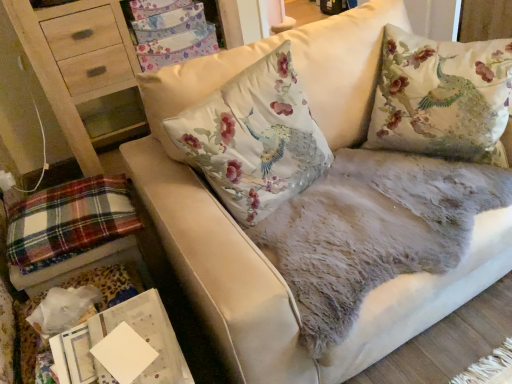
Question: Can you confirm if plaid fabric at lower left is taller than floral fabric cushion at center, the 1th pillow when ordered from left to right?

Choices:
 (A) no
 (B) yes

Answer: (A)

Question: Is plaid fabric at lower left at the left side of floral fabric cushion at center, the 1th pillow when ordered from left to right?

Choices:
 (A) yes
 (B) no

Answer: (A)

Question: Can we say plaid fabric at lower left lies outside floral fabric cushion at center, positioned as the second pillow in right-to-left order?

Choices:
 (A) no
 (B) yes

Answer: (B)

Question: From the image's perspective, is plaid fabric at lower left below floral fabric cushion at center, positioned as the second pillow in right-to-left order?

Choices:
 (A) yes
 (B) no

Answer: (A)

Question: Is plaid fabric at lower left thinner than floral fabric cushion at center, positioned as the second pillow in right-to-left order?

Choices:
 (A) no
 (B) yes

Answer: (A)

Question: Is silky floral pillow at upper right, the first pillow positioned from the right, spatially inside floral fabric cushion at center, the 1th pillow when ordered from left to right, or outside of it?

Choices:
 (A) outside
 (B) inside

Answer: (A)

Question: Is silky floral pillow at upper right, the first pillow positioned from the right, taller or shorter than floral fabric cushion at center, the 1th pillow when ordered from left to right?

Choices:
 (A) tall
 (B) short

Answer: (A)

Question: Does point (465, 72) appear closer or farther from the camera than point (287, 158)?

Choices:
 (A) closer
 (B) farther

Answer: (B)

Question: From a real-world perspective, is silky floral pillow at upper right, the first pillow positioned from the right, physically located above or below floral fabric cushion at center, the 1th pillow when ordered from left to right?

Choices:
 (A) above
 (B) below

Answer: (B)

Question: From the image's perspective, is plaid fabric at lower left positioned above or below silky floral pillow at upper right, the first pillow positioned from the right?

Choices:
 (A) below
 (B) above

Answer: (A)

Question: Considering the positions of plaid fabric at lower left and silky floral pillow at upper right, the 2th pillow when ordered from left to right, in the image, is plaid fabric at lower left taller or shorter than silky floral pillow at upper right, the 2th pillow when ordered from left to right,?

Choices:
 (A) tall
 (B) short

Answer: (B)

Question: In terms of width, does plaid fabric at lower left look wider or thinner when compared to silky floral pillow at upper right, the first pillow positioned from the right?

Choices:
 (A) thin
 (B) wide

Answer: (A)

Question: From a real-world perspective, relative to silky floral pillow at upper right, the first pillow positioned from the right, is plaid fabric at lower left vertically above or below?

Choices:
 (A) above
 (B) below

Answer: (B)

Question: From their relative heights in the image, would you say floral fabric cushion at center, the 1th pillow when ordered from left to right, is taller or shorter than floral fabric cushion at upper right?

Choices:
 (A) tall
 (B) short

Answer: (B)

Question: Is floral fabric cushion at center, positioned as the second pillow in right-to-left order, inside or outside of floral fabric cushion at upper right?

Choices:
 (A) outside
 (B) inside

Answer: (A)